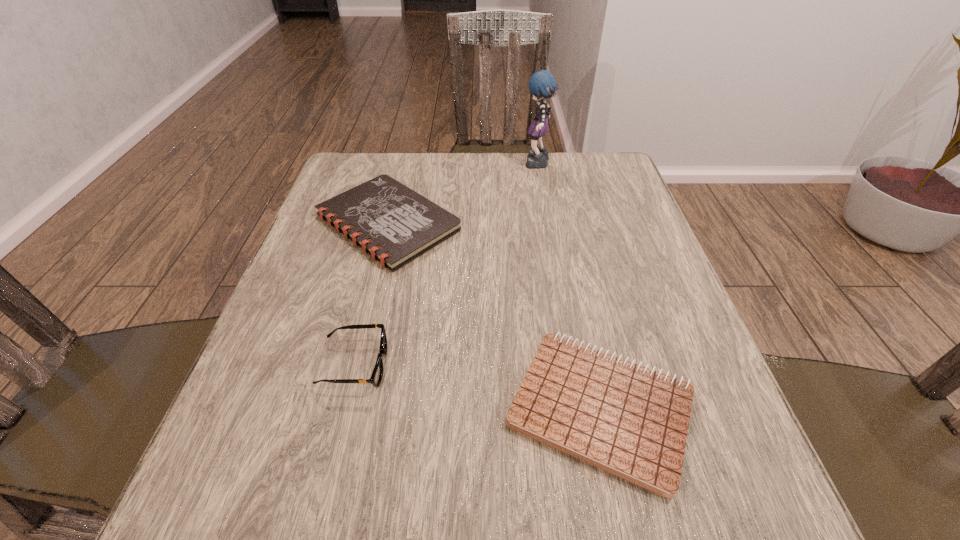
Identify the location of object that is at the near right corner. The width and height of the screenshot is (960, 540). (631, 421).

This screenshot has width=960, height=540. I want to click on vacant area at the far edge, so click(x=492, y=188).

I want to click on vacant space at the left edge of the desktop, so click(x=307, y=384).

I want to click on free region at the right edge of the desktop, so (x=669, y=305).

At what (x,y) coordinates should I click in order to perform the action: click on vacant space at the far left corner of the desktop. Please return your answer as a coordinate pair (x, y). This screenshot has width=960, height=540. Looking at the image, I should click on (348, 180).

This screenshot has width=960, height=540. I want to click on free spot at the far right corner of the desktop, so click(600, 187).

In the image, there is a desktop. At what (x,y) coordinates should I click in order to perform the action: click on vacant area at the near right corner. Please return your answer as a coordinate pair (x, y). Image resolution: width=960 pixels, height=540 pixels. Looking at the image, I should click on (751, 523).

The height and width of the screenshot is (540, 960). Identify the location of free space between the sunglasses and the right notebook. (478, 387).

You are a GUI agent. You are given a task and a screenshot of the screen. Output one action in this format:
    pyautogui.click(x=<x>, y=<y>)
    Task: Click on the blank region between the sunglasses and the rag doll
    The width and height of the screenshot is (960, 540).
    Given the screenshot: What is the action you would take?
    pyautogui.click(x=446, y=265)

Find the location of a particular element. free space between the right notebook and the tallest object is located at coordinates (569, 287).